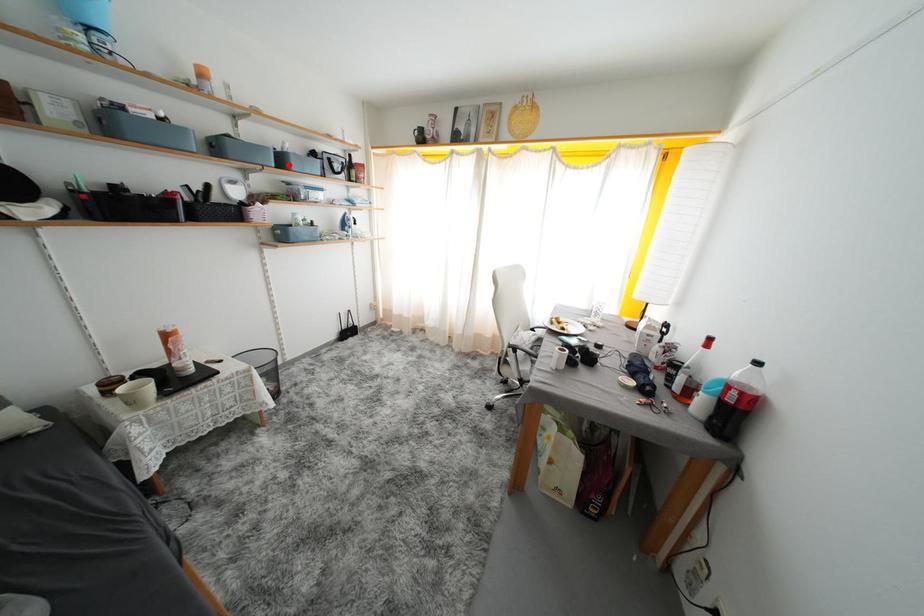
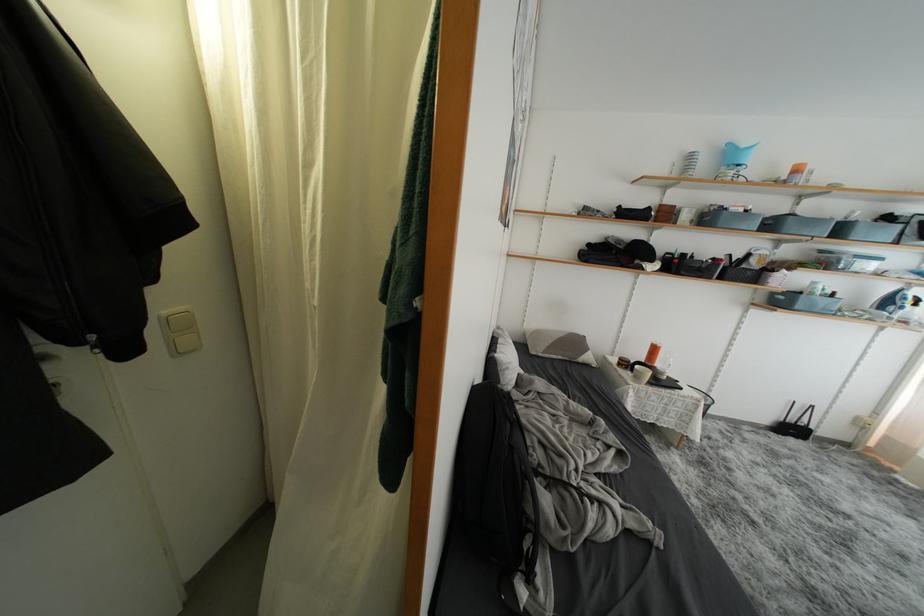
Where in the second image is the point corresponding to the highlighted location from the first image?

(847, 235)